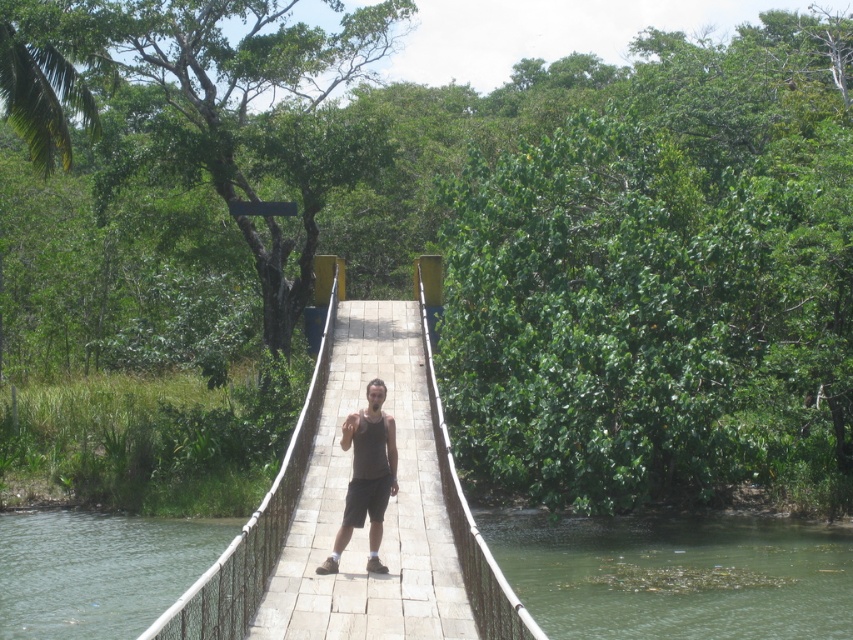
Consider the image. Can you confirm if wooden bridge at center is taller than dark gray tank top at center?

Indeed, wooden bridge at center has a greater height compared to dark gray tank top at center.

From the picture: Does wooden bridge at center have a lesser height compared to dark gray tank top at center?

Incorrect, wooden bridge at center's height does not fall short of dark gray tank top at center's.

Between point (486, 573) and point (390, 454), which one is positioned in front?

Point (486, 573)

The height and width of the screenshot is (640, 853). Identify the location of wooden bridge at center. (254, 524).

Is green murky water at center shorter than green murky water at lower center?

No, green murky water at center is not shorter than green murky water at lower center.

Describe the element at coordinates (676, 576) in the screenshot. I see `green murky water at center` at that location.

Who is more distant from viewer, (91, 538) or (815, 566)?

Point (91, 538)

The height and width of the screenshot is (640, 853). In order to click on green murky water at center in this screenshot , I will do `click(676, 576)`.

Based on the photo, is green murky water at center thinner than green water at lower left?

No, green murky water at center is not thinner than green water at lower left.

Does green murky water at center have a greater height compared to green water at lower left?

Yes.

Is point (669, 576) less distant than point (33, 563)?

Yes, point (669, 576) is in front of point (33, 563).

Where is `green murky water at center`? green murky water at center is located at coordinates (676, 576).